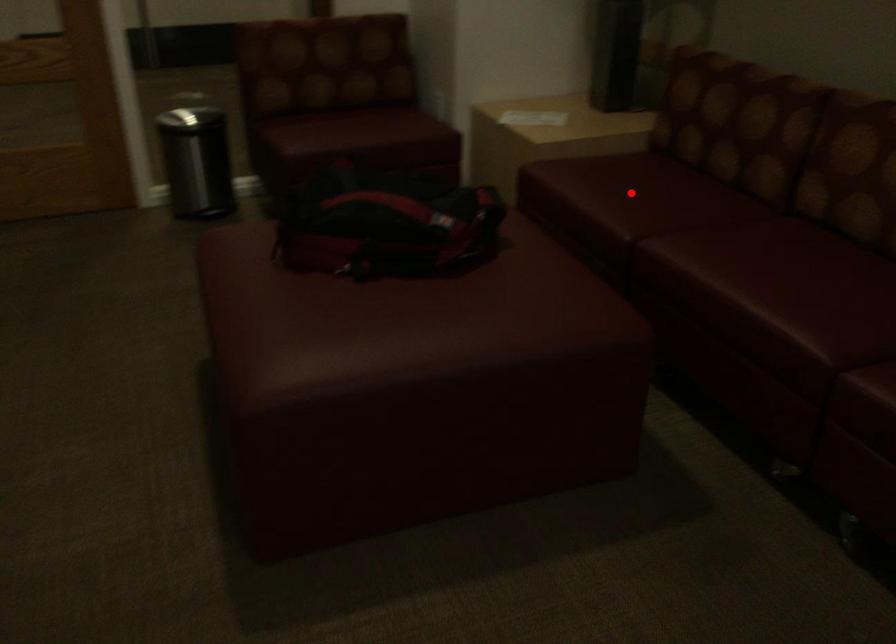
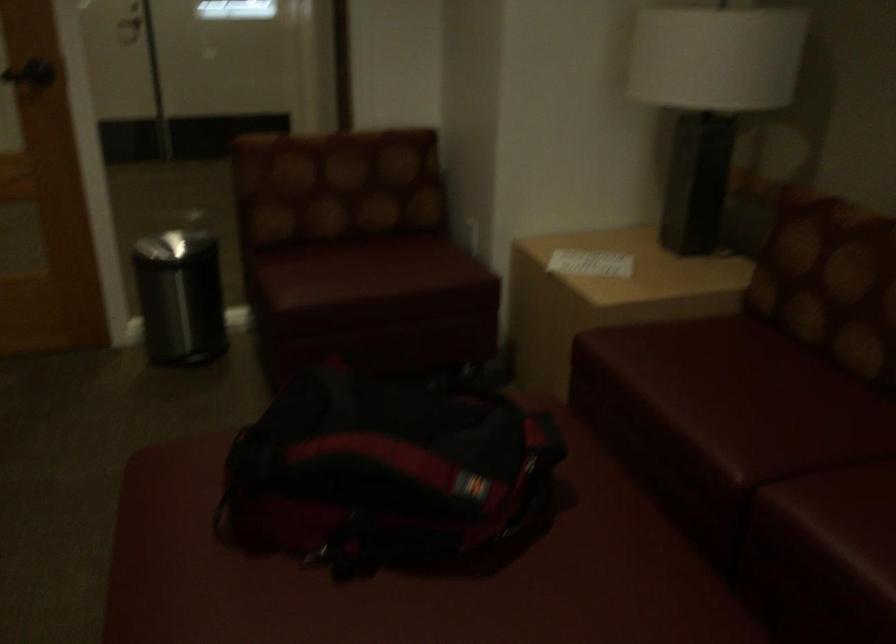
Where in the second image is the point corresponding to the highlighted location from the first image?

(731, 397)